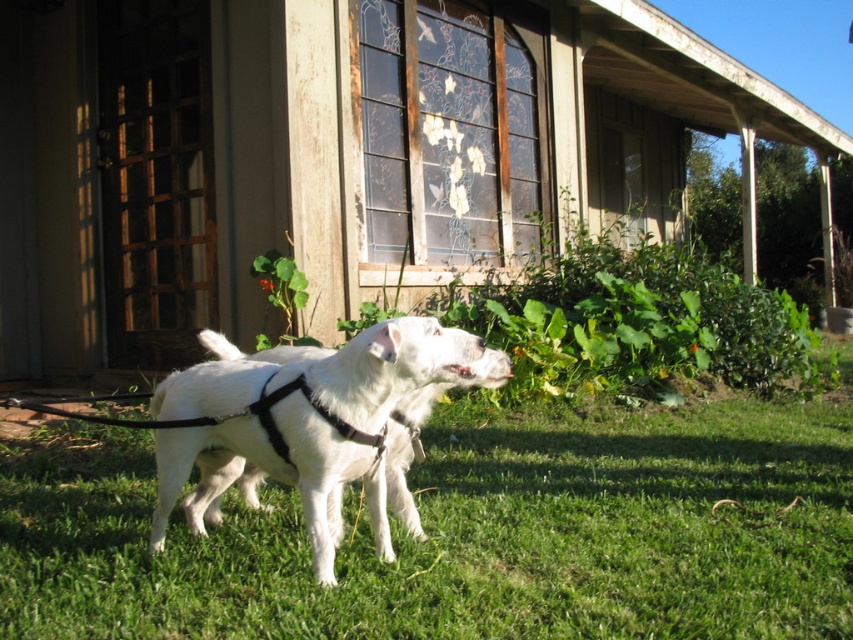
Based on the photo, which of these two, wooden porch at center or white matte harness at center, stands taller?

wooden porch at center is taller.

Can you confirm if wooden porch at center is positioned below white matte harness at center?

No, wooden porch at center is not below white matte harness at center.

This screenshot has width=853, height=640. What do you see at coordinates (328, 154) in the screenshot?
I see `wooden porch at center` at bounding box center [328, 154].

The image size is (853, 640). I want to click on wooden porch at center, so click(x=328, y=154).

Is point (474, 573) more distant than point (285, 481)?

That is False.

Between point (44, 435) and point (306, 433), which one is positioned behind?

The point (44, 435) is more distant.

Locate an element on the screen. The image size is (853, 640). green grass at lower center is located at coordinates (463, 532).

Locate an element on the screen. green grass at lower center is located at coordinates (463, 532).

Is wooden porch at center closer to the viewer compared to green grass at lower center?

No.

This screenshot has width=853, height=640. In order to click on wooden porch at center in this screenshot , I will do `click(328, 154)`.

The height and width of the screenshot is (640, 853). I want to click on wooden porch at center, so click(x=328, y=154).